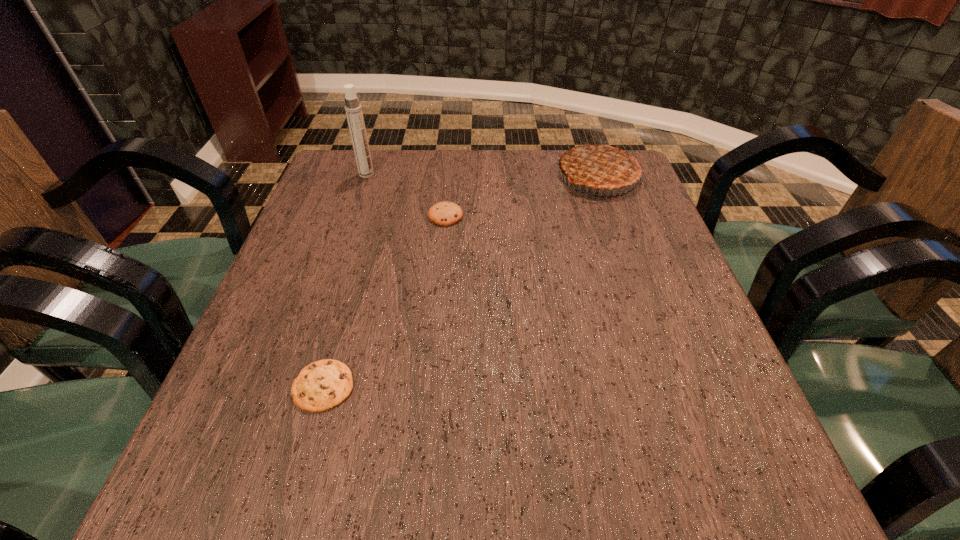
This screenshot has width=960, height=540. I want to click on aerosol can, so click(x=354, y=114).

This screenshot has width=960, height=540. I want to click on the rightmost object, so click(604, 165).

I want to click on the third shortest object, so 604,165.

You are a GUI agent. You are given a task and a screenshot of the screen. Output one action in this format:
    pyautogui.click(x=<x>, y=<y>)
    Task: Click on the farther cookie
    The height and width of the screenshot is (540, 960).
    Given the screenshot: What is the action you would take?
    pyautogui.click(x=446, y=213)

The image size is (960, 540). In order to click on the taller cookie in this screenshot , I will do `click(446, 213)`.

This screenshot has height=540, width=960. Find the location of `the shorter cookie`. the shorter cookie is located at coordinates (322, 385).

The height and width of the screenshot is (540, 960). I want to click on the nearer cookie, so click(322, 385).

Where is `free location located 0.080m on the back of the tallest object`? The image size is (960, 540). free location located 0.080m on the back of the tallest object is located at coordinates (372, 156).

Identify the location of free region located 0.180m on the left of the second tallest object. (492, 176).

At what (x,y) coordinates should I click in order to perform the action: click on vacant space located 0.310m on the left of the right cookie. Please return your answer as a coordinate pair (x, y). This screenshot has width=960, height=540. Looking at the image, I should click on (301, 215).